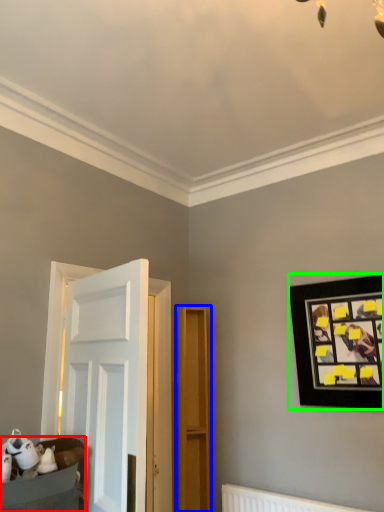
Question: Which object is the closest to the furniture (highlighted by a red box)? Choose among these: dresser (highlighted by a blue box) or picture frame (highlighted by a green box).

Choices:
 (A) dresser
 (B) picture frame

Answer: (A)